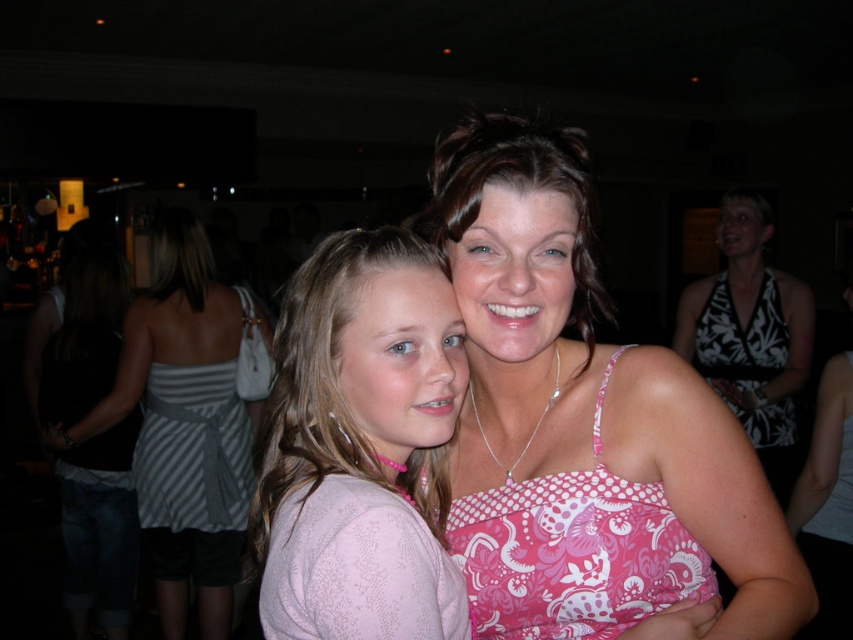
Between pink lace sweater at center and pink dotted tank top at center, which one is positioned lower?

Positioned lower is pink lace sweater at center.

Does pink lace sweater at center appear on the left side of pink dotted tank top at center?

Correct, you'll find pink lace sweater at center to the left of pink dotted tank top at center.

Does point (296, 442) come in front of point (532, 173)?

That is False.

Identify the location of pink lace sweater at center. The width and height of the screenshot is (853, 640). (358, 448).

Looking at this image, is pink lace sweater at center shorter than white floral print dress at right?

Yes, pink lace sweater at center is shorter than white floral print dress at right.

Is pink lace sweater at center below white floral print dress at right?

Yes.

What are the coordinates of `pink lace sweater at center` in the screenshot? It's located at (358, 448).

Find the location of a particular element. pink lace sweater at center is located at coordinates (358, 448).

Does pink lace sweater at center appear over white floral dress at right?

No.

Can you confirm if pink lace sweater at center is positioned below white floral dress at right?

Correct, pink lace sweater at center is located below white floral dress at right.

Does point (402, 232) come closer to viewer compared to point (752, 221)?

Yes, it is in front of point (752, 221).

Identify the location of pink lace sweater at center. This screenshot has width=853, height=640. (358, 448).